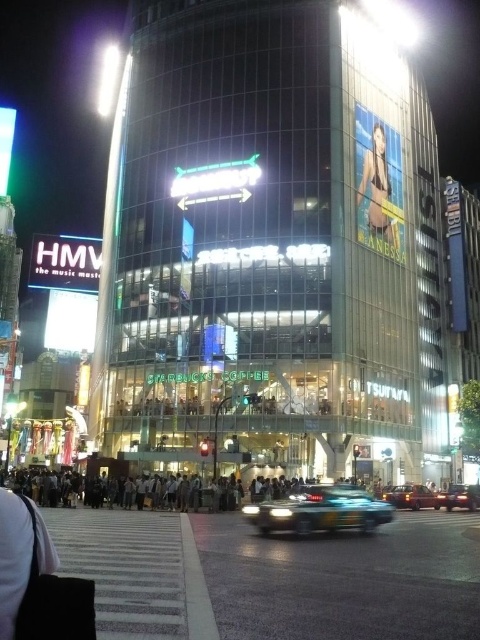
You are a delivery person trying to navigate through the city at night. You need to deliver a package to a clear plastic billboard at upper center. The GPS says you are currently at point (377, 189). Can you confirm if you are already at the destination?

Yes, you are already at the destination because the clear plastic billboard at upper center is located exactly at point (377, 189).

You are a delivery driver who needs to park your vehicle in a space that requires a height clearance of 1.8 meters. You observe a metallic blue car at center and a matte red sedan at center in the parking lot. Which vehicle would you choose to park in the space to ensure it fits?

The metallic blue car at center is taller than the matte red sedan at center, so the matte red sedan at center would fit better under the 1.8 meters height clearance.

You are driving a car and approaching the clear plastic billboard at upper center and the matte red sedan at center. Which object will you see first as you drive closer?

You will see the clear plastic billboard at upper center first because it is closer to you than the matte red sedan at center.